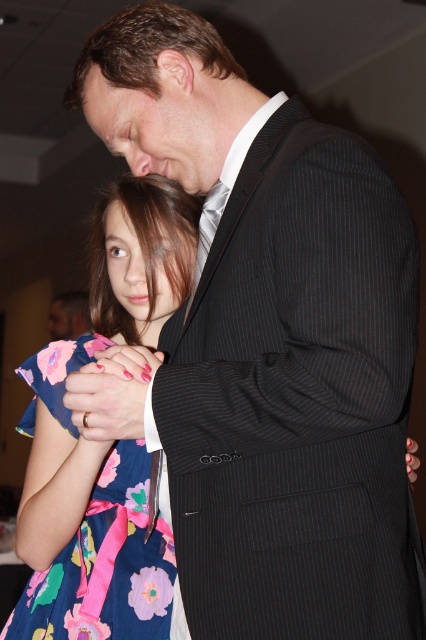
Question: Which object is farther from the camera taking this photo?

Choices:
 (A) silky white tie at center
 (B) black pinstripe suit at upper center
 (C) matte black suit at upper center
 (D) floral cotton dress at center

Answer: (C)

Question: Is black pinstripe suit at upper center above silky white tie at center?

Choices:
 (A) yes
 (B) no

Answer: (B)

Question: Which object is the farthest from the floral cotton dress at center?

Choices:
 (A) matte black suit at upper center
 (B) silky white tie at center

Answer: (A)

Question: Is black pinstripe suit at upper center smaller than silky white tie at center?

Choices:
 (A) no
 (B) yes

Answer: (A)

Question: Where is matte black suit at upper center located in relation to silky white tie at center in the image?

Choices:
 (A) above
 (B) below

Answer: (B)

Question: Which of the following is the closest to the observer?

Choices:
 (A) floral cotton dress at center
 (B) silky white tie at center

Answer: (B)